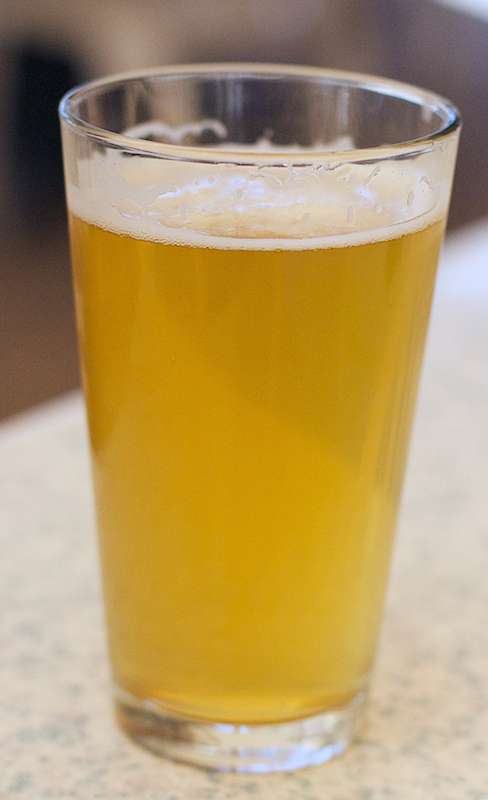
The height and width of the screenshot is (800, 488). I want to click on back rim of drinking glass, so (215, 65), (326, 72).